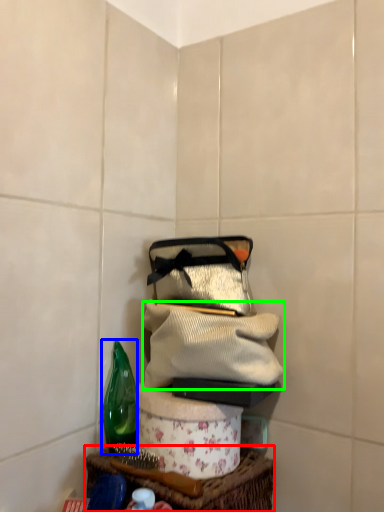
Question: Based on their relative distances, which object is nearer to table (highlighted by a red box)? Choose from bottle (highlighted by a blue box) and clothing (highlighted by a green box).

Choices:
 (A) bottle
 (B) clothing

Answer: (A)